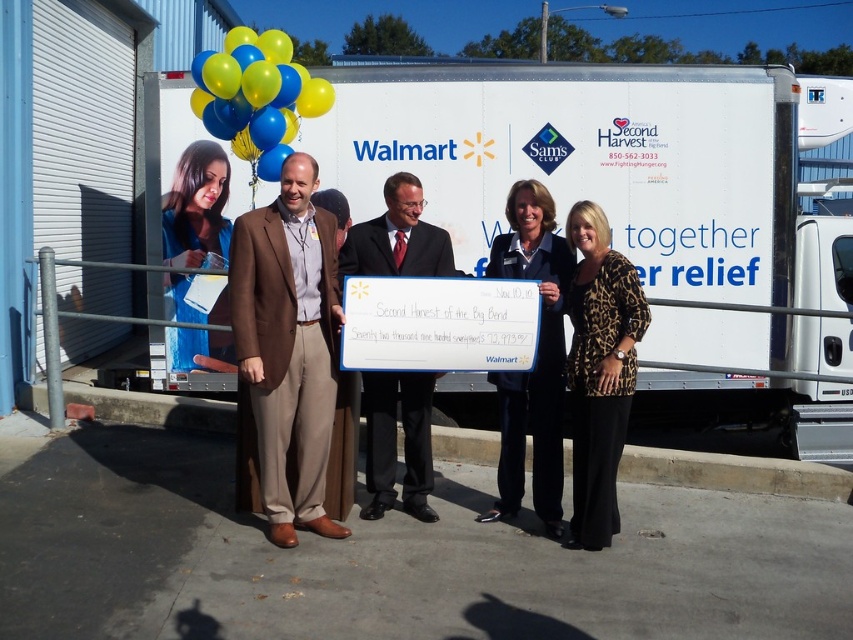
Is brown fabric suit at center shorter than blue glossy balloons at upper left?

Incorrect, brown fabric suit at center's height does not fall short of blue glossy balloons at upper left's.

Consider the image. Is brown fabric suit at center wider than blue glossy balloons at upper left?

In fact, brown fabric suit at center might be narrower than blue glossy balloons at upper left.

What are the coordinates of `brown fabric suit at center` in the screenshot? It's located at 288,346.

How distant is white matte truck at center from brown fabric suit at center?

A distance of 3.55 meters exists between white matte truck at center and brown fabric suit at center.

Between point (737, 81) and point (283, 280), which one is positioned in front?

Point (283, 280)

I want to click on white matte truck at center, so click(607, 163).

How far apart are brown fabric suit at center and dark blue suit at center?

brown fabric suit at center is 1.21 meters from dark blue suit at center.

This screenshot has width=853, height=640. What do you see at coordinates (288, 346) in the screenshot? I see `brown fabric suit at center` at bounding box center [288, 346].

Identify the location of brown fabric suit at center. (288, 346).